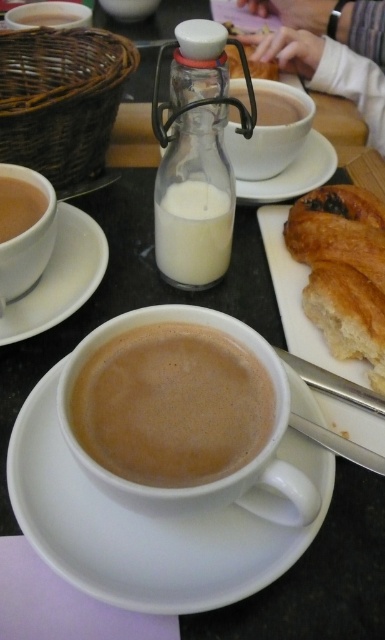
You are a barista trying to place a new coffee cup on the table. The table has limited space between the white ceramic saucer at upper center and the matte white cup at left. Can you fit the new cup there if the height difference between them is significant?

The white ceramic saucer at upper center is much taller than the matte white cup at left, so the height difference may make it difficult to place the new cup between them without tilting or instability.